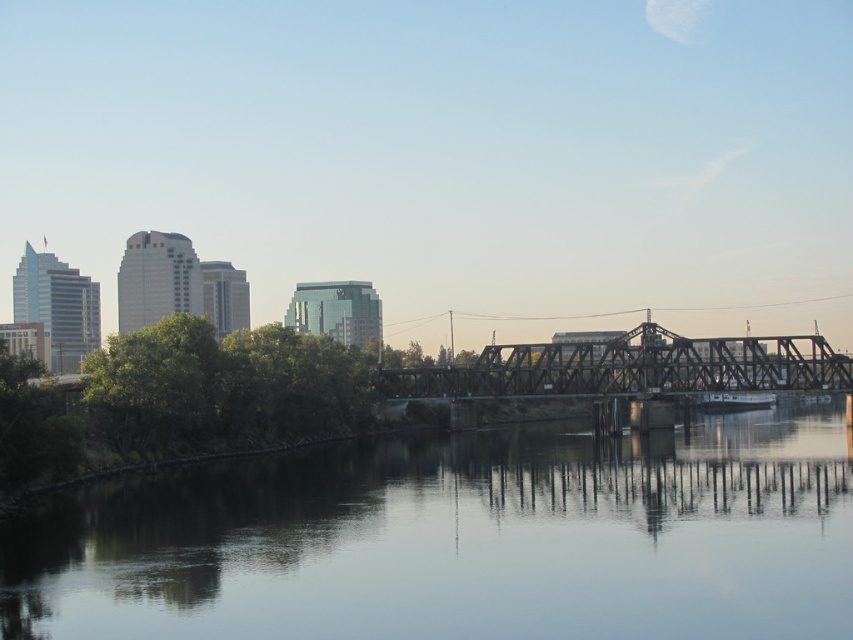
Question: Among these points, which one is farthest from the camera?

Choices:
 (A) (265, 515)
 (B) (556, 342)

Answer: (B)

Question: In this image, where is smooth water at center located relative to black steel bridge at center?

Choices:
 (A) right
 (B) left

Answer: (B)

Question: Which point appears closest to the camera in this image?

Choices:
 (A) (62, 570)
 (B) (695, 368)

Answer: (A)

Question: Can you confirm if smooth water at center is positioned below black steel bridge at center?

Choices:
 (A) yes
 (B) no

Answer: (A)

Question: In this image, where is smooth water at center located relative to black steel bridge at center?

Choices:
 (A) below
 (B) above

Answer: (A)